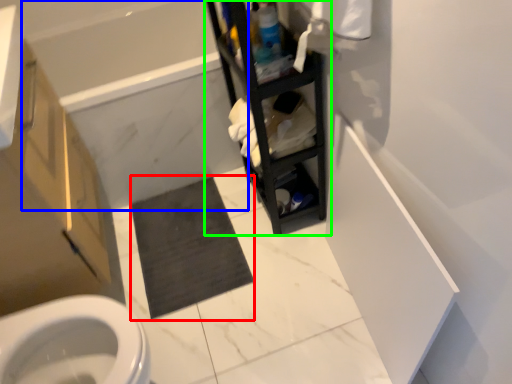
Question: Which is nearer to the bath mat (highlighted by a red box)? bath (highlighted by a blue box) or shelf (highlighted by a green box).

Choices:
 (A) bath
 (B) shelf

Answer: (A)